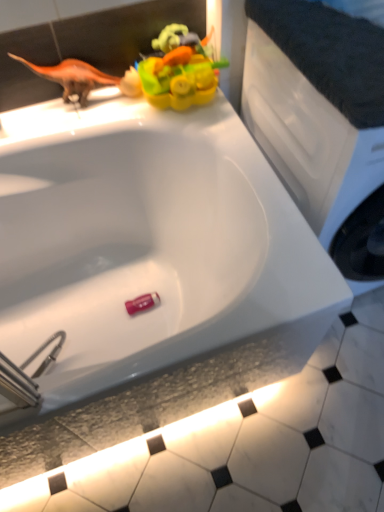
Question: Do you think rubber duck at upper center, which ranks as the 2th toy in bottom-to-top order, is within white matte counter top at upper right, or outside of it?

Choices:
 (A) outside
 (B) inside

Answer: (A)

Question: In terms of width, does rubber duck at upper center, which ranks as the 2th toy in bottom-to-top order, look wider or thinner when compared to white matte counter top at upper right?

Choices:
 (A) thin
 (B) wide

Answer: (A)

Question: Considering the real-world distances, which object is farthest from the white matte counter top at upper right?

Choices:
 (A) pink plastic eraser at bottom, acting as the second toy starting from the top
 (B) rubber duck at upper center, which is the second toy in back-to-front order
 (C) white glossy tile at lower center
 (D) orange matte dinosaur at upper left

Answer: (C)

Question: Which object is the farthest from the orange matte dinosaur at upper left?

Choices:
 (A) white glossy tile at lower center
 (B) pink plastic eraser at bottom, which ranks as the 2th toy in front-to-back order
 (C) white matte counter top at upper right
 (D) rubber duck at upper center, which ranks as the 2th toy in bottom-to-top order

Answer: (A)